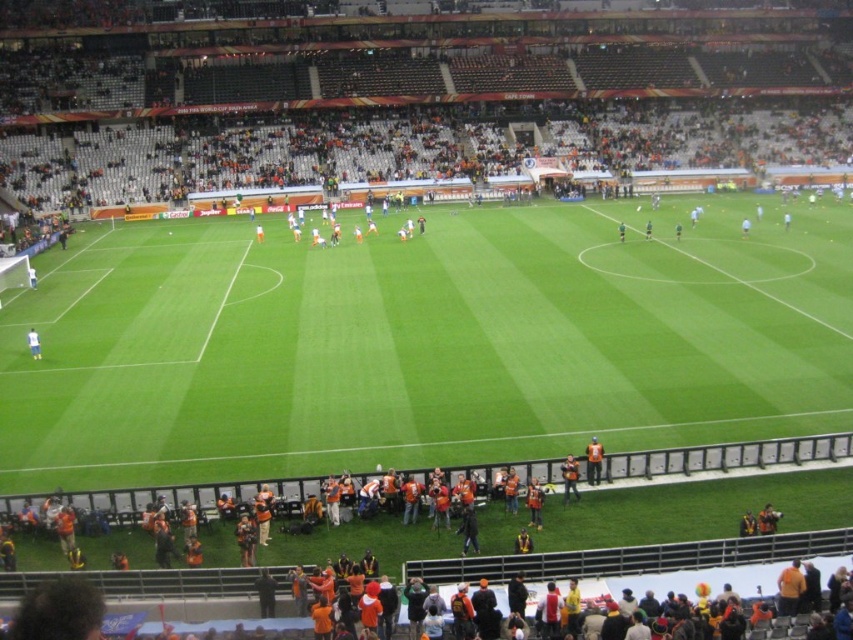
Question: Which object is farther from the camera taking this photo?

Choices:
 (A) white matte shirt at lower left
 (B) orange jersey at center

Answer: (A)

Question: Does green grass football field at center have a lesser width compared to white matte shirt at lower left?

Choices:
 (A) no
 (B) yes

Answer: (A)

Question: Among these points, which one is farthest from the camera?

Choices:
 (A) (39, 346)
 (B) (593, 456)
 (C) (518, 273)
 (D) (567, 468)

Answer: (C)

Question: Which is farther from the orange jersey at center?

Choices:
 (A) white matte shirt at lower left
 (B) green grass football field at center

Answer: (A)

Question: Does green grass football field at center lie in front of orange fabric jacket at lower center?

Choices:
 (A) yes
 (B) no

Answer: (A)

Question: Is orange jersey at center wider than orange fabric jacket at lower center?

Choices:
 (A) yes
 (B) no

Answer: (B)